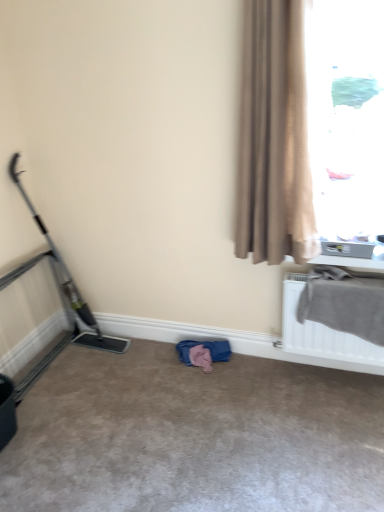
Question: Can you confirm if metallic gray baby carriage at left is wider than beige textured curtain at right?

Choices:
 (A) yes
 (B) no

Answer: (A)

Question: Does metallic gray baby carriage at left appear on the right side of beige textured curtain at right?

Choices:
 (A) no
 (B) yes

Answer: (A)

Question: From a real-world perspective, is metallic gray baby carriage at left beneath beige textured curtain at right?

Choices:
 (A) no
 (B) yes

Answer: (B)

Question: Does metallic gray baby carriage at left come behind beige textured curtain at right?

Choices:
 (A) no
 (B) yes

Answer: (B)

Question: Is metallic gray baby carriage at left shorter than beige textured curtain at right?

Choices:
 (A) yes
 (B) no

Answer: (A)

Question: Considering the positions of translucent glass window at upper right and beige carpet at center in the image, is translucent glass window at upper right wider or thinner than beige carpet at center?

Choices:
 (A) thin
 (B) wide

Answer: (A)

Question: Is translucent glass window at upper right in front of or behind beige carpet at center in the image?

Choices:
 (A) front
 (B) behind

Answer: (B)

Question: Is point (324, 212) positioned closer to the camera than point (221, 385)?

Choices:
 (A) farther
 (B) closer

Answer: (B)

Question: From the image's perspective, is translucent glass window at upper right positioned above or below beige carpet at center?

Choices:
 (A) below
 (B) above

Answer: (B)

Question: From a real-world perspective, is metallic gray baby carriage at left positioned above or below translucent glass window at upper right?

Choices:
 (A) above
 (B) below

Answer: (B)

Question: Considering the positions of metallic gray baby carriage at left and translucent glass window at upper right in the image, is metallic gray baby carriage at left taller or shorter than translucent glass window at upper right?

Choices:
 (A) tall
 (B) short

Answer: (A)

Question: Considering their positions, is metallic gray baby carriage at left located in front of or behind translucent glass window at upper right?

Choices:
 (A) behind
 (B) front

Answer: (A)

Question: From the image's perspective, is metallic gray baby carriage at left above or below translucent glass window at upper right?

Choices:
 (A) below
 (B) above

Answer: (A)

Question: In the image, is beige carpet at center positioned in front of or behind gray fabric at upper right?

Choices:
 (A) behind
 (B) front

Answer: (B)

Question: Considering the positions of beige carpet at center and gray fabric at upper right in the image, is beige carpet at center wider or thinner than gray fabric at upper right?

Choices:
 (A) thin
 (B) wide

Answer: (B)